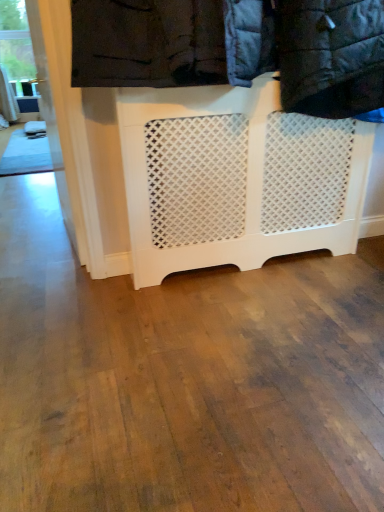
The width and height of the screenshot is (384, 512). I want to click on vacant space underneath white lattice radiator at center (from a real-world perspective), so click(x=254, y=268).